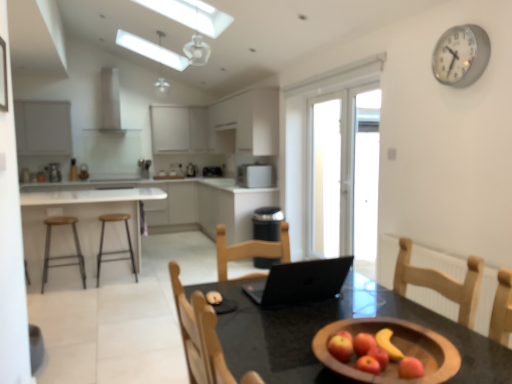
I want to click on spots to the right of wooden/metallic stool at left, the 1th stool from the right, so click(153, 279).